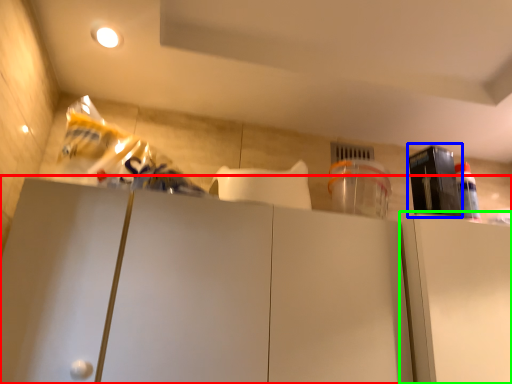
Question: Considering the real-world distances, which object is farthest from cabinetry (highlighted by a red box)? appliance (highlighted by a blue box) or cabinetry (highlighted by a green box)?

Choices:
 (A) appliance
 (B) cabinetry

Answer: (A)